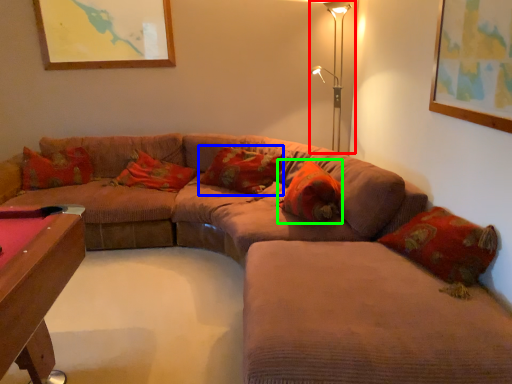
Question: Which is nearer to the table lamp (highlighted by a red box)? pillow (highlighted by a blue box) or pillow (highlighted by a green box).

Choices:
 (A) pillow
 (B) pillow

Answer: (A)